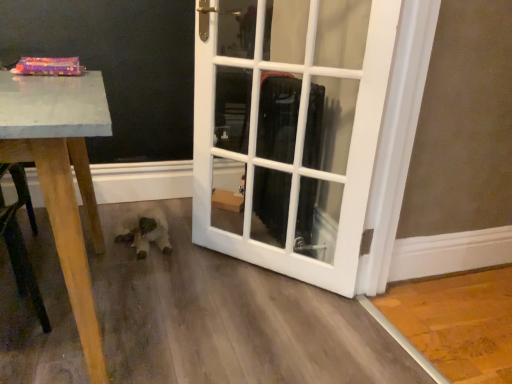
Find the location of `vacant area that is in front of white glossy door at center`. vacant area that is in front of white glossy door at center is located at coordinates (262, 342).